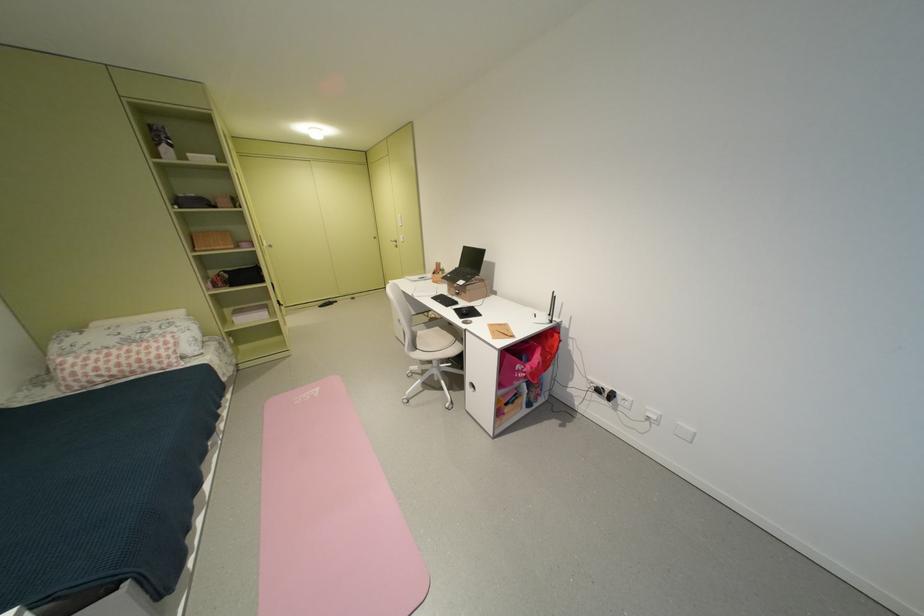
Which object does [467,312] point to?

It corresponds to the black computer trackpad in the image.